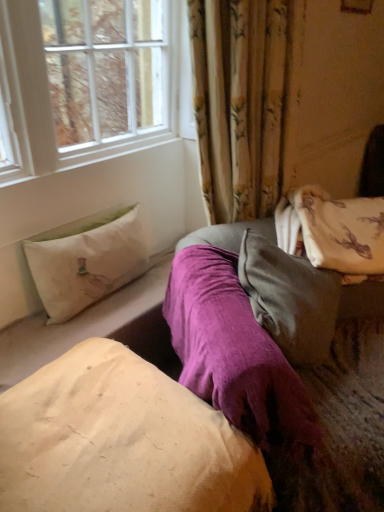
The height and width of the screenshot is (512, 384). I want to click on vacant area situated below white fabric pillow at left, placed as the 3th pillow when sorted from bottom to top (from a real-world perspective), so click(x=112, y=295).